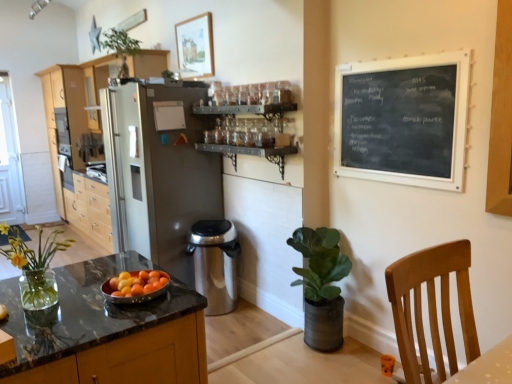
This screenshot has width=512, height=384. Identify the location of blank space situated above metallic bowl of fruit at center (from a real-world perspective). (132, 278).